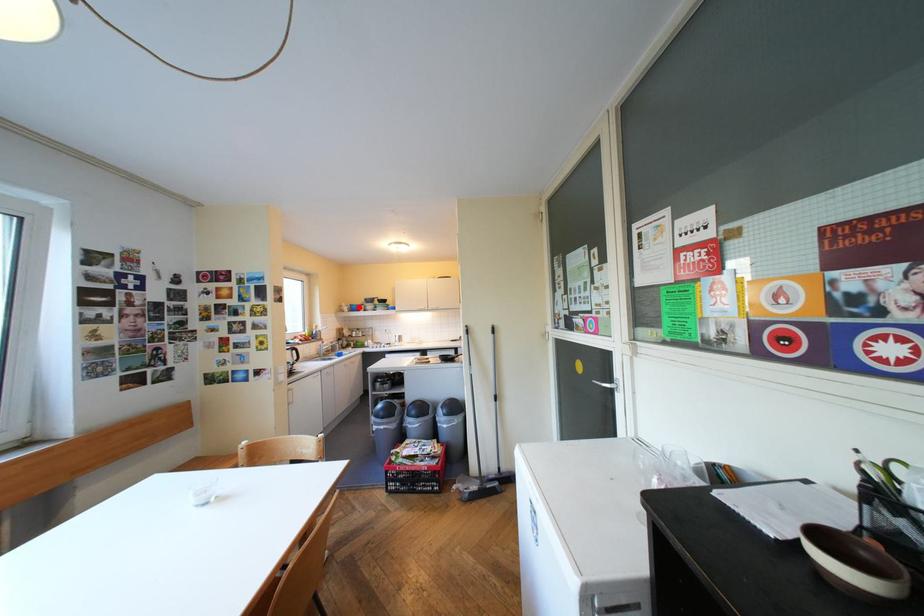
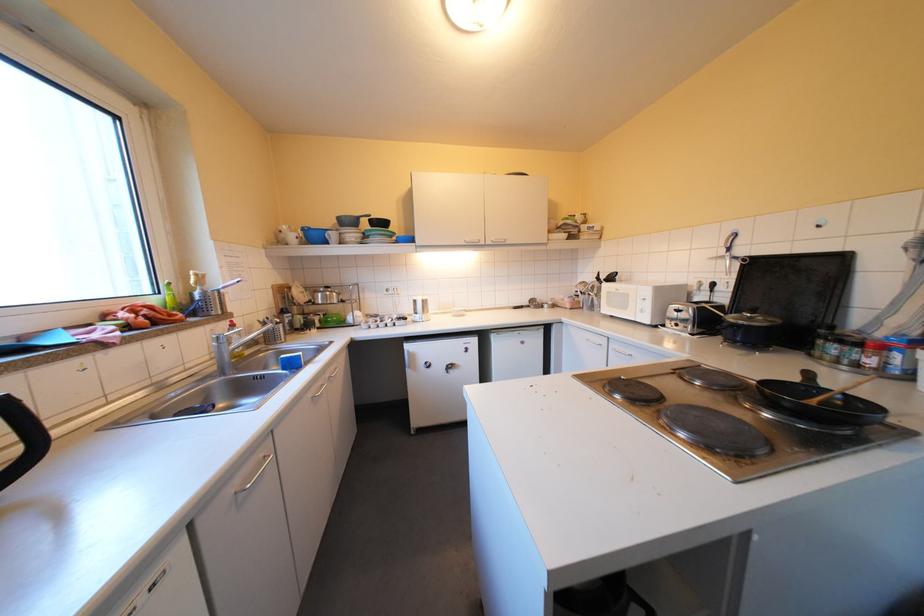
Find the pixel in the second image that matches the highlighted location in the first image.

(305, 236)